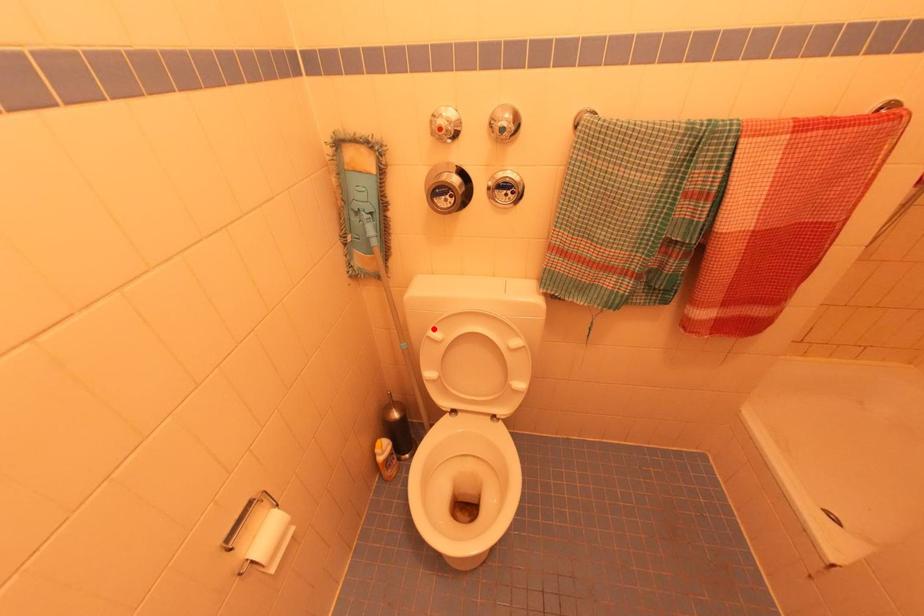
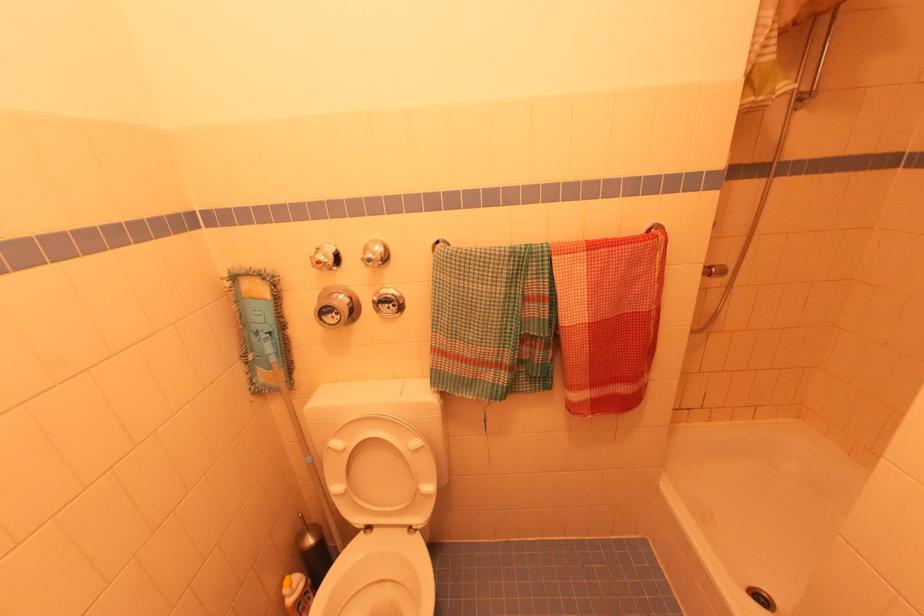
Question: I am providing you with two images of the same scene from different viewpoints. A red point is marked on the first image. At the location where the point appears in image 1, is it still visible in image 2?

Choices:
 (A) Yes
 (B) No

Answer: (A)